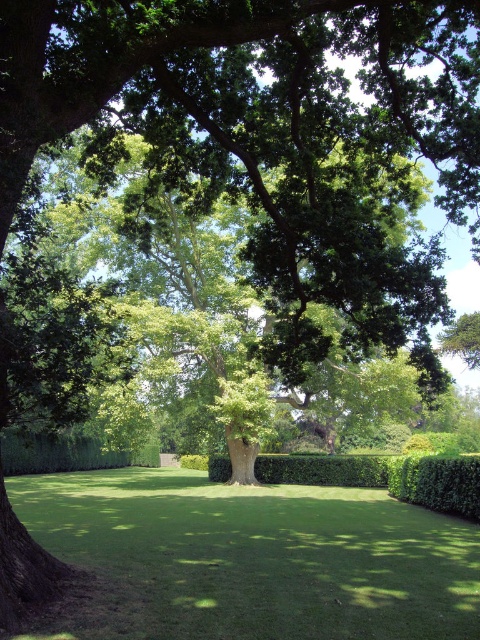
What do you see at coordinates (254, 557) in the screenshot? I see `green grass at center` at bounding box center [254, 557].

Can you confirm if green grass at center is positioned above green leafy hedge at lower right?

Actually, green grass at center is below green leafy hedge at lower right.

This screenshot has height=640, width=480. Identify the location of green grass at center. (254, 557).

Which is below, green leafy hedge at lower right or green leafy hedge at lower center?

Positioned lower is green leafy hedge at lower center.

Is green leafy hedge at lower right smaller than green leafy hedge at lower center?

Yes.

Find the location of a particular element. The width and height of the screenshot is (480, 640). green leafy hedge at lower right is located at coordinates (436, 483).

This screenshot has height=640, width=480. Find the location of `green leafy hedge at lower right`. green leafy hedge at lower right is located at coordinates (436, 483).

Does green grass at center come behind green leafy hedge at lower center?

No, green grass at center is closer to the viewer.

From the picture: Does green grass at center appear under green leafy hedge at lower center?

Actually, green grass at center is above green leafy hedge at lower center.

Between point (202, 522) and point (131, 460), which one is positioned in front?

Point (202, 522)

Identify the location of green grass at center. This screenshot has width=480, height=640. (254, 557).